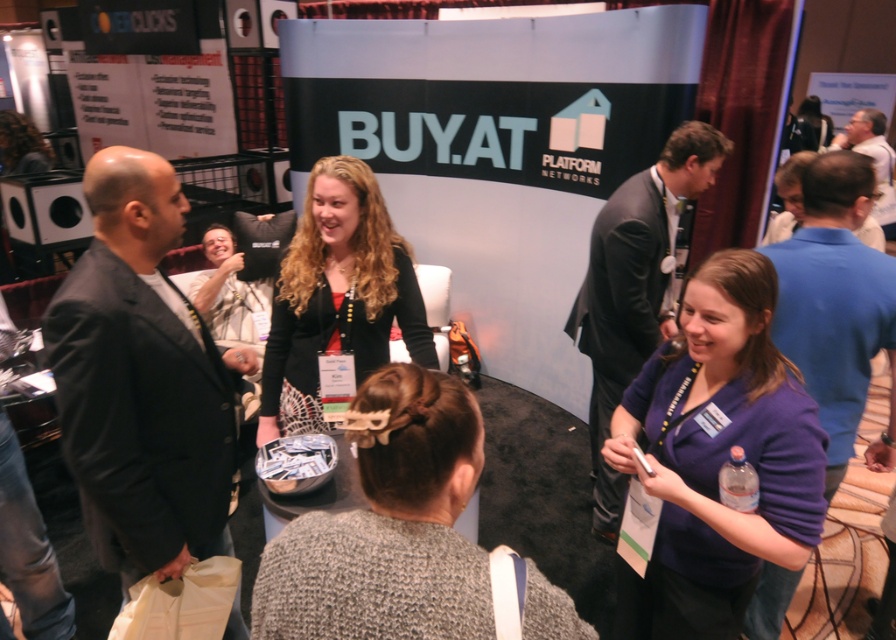
Is dark gray suit at left wider than white shirt at center?

No.

Can you confirm if dark gray suit at left is positioned below white shirt at center?

Yes.

Between point (240, 636) and point (881, 122), which one is positioned behind?

The point (881, 122) is behind.

You are a GUI agent. You are given a task and a screenshot of the screen. Output one action in this format:
    pyautogui.click(x=<x>, y=<y>)
    Task: Click on the dark gray suit at left
    Image resolution: width=896 pixels, height=640 pixels.
    Given the screenshot: What is the action you would take?
    pyautogui.click(x=141, y=380)

Is point (762, 452) positioned in front of point (781, 572)?

Yes, point (762, 452) is in front of point (781, 572).

This screenshot has width=896, height=640. I want to click on purple fabric shirt at lower right, so click(x=717, y=456).

Can you confirm if knitted gray sweater at center is thinner than white shirt at center?

Yes, knitted gray sweater at center is thinner than white shirt at center.

Between knitted gray sweater at center and white shirt at center, which one has more height?

white shirt at center is taller.

This screenshot has height=640, width=896. I want to click on knitted gray sweater at center, so click(x=389, y=528).